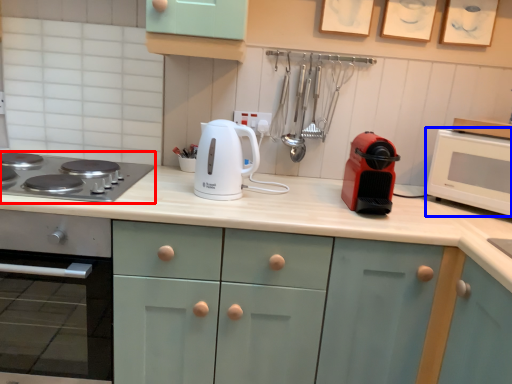
Question: Among these objects, which one is farthest to the camera, gas stove (highlighted by a red box) or microwave oven (highlighted by a blue box)?

Choices:
 (A) gas stove
 (B) microwave oven

Answer: (B)